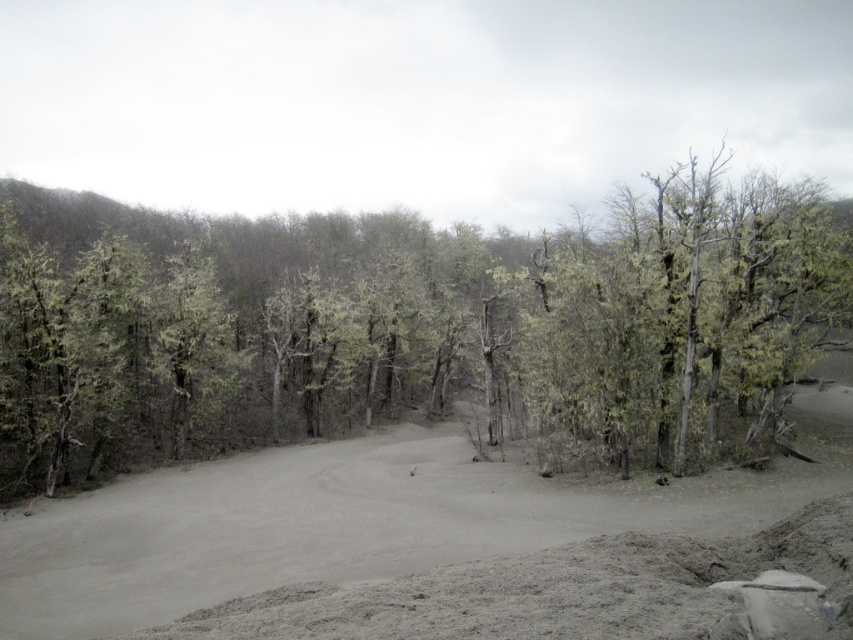
Question: Observing the image, what is the correct spatial positioning of green mossy tree at center in reference to gray sandy dirt track at center?

Choices:
 (A) left
 (B) right

Answer: (B)

Question: Among these points, which one is farthest from the camera?

Choices:
 (A) (314, 550)
 (B) (384, 625)

Answer: (A)

Question: Does green mossy tree at center have a lesser width compared to gray sandy road at center?

Choices:
 (A) yes
 (B) no

Answer: (B)

Question: Which point is farther to the camera?

Choices:
 (A) green mossy tree at center
 (B) gray sandy road at center

Answer: (A)

Question: Is green mossy tree at center closer to the viewer compared to gray sandy dirt track at center?

Choices:
 (A) yes
 (B) no

Answer: (B)

Question: Which point is farther to the camera?

Choices:
 (A) (24, 630)
 (B) (515, 632)

Answer: (A)